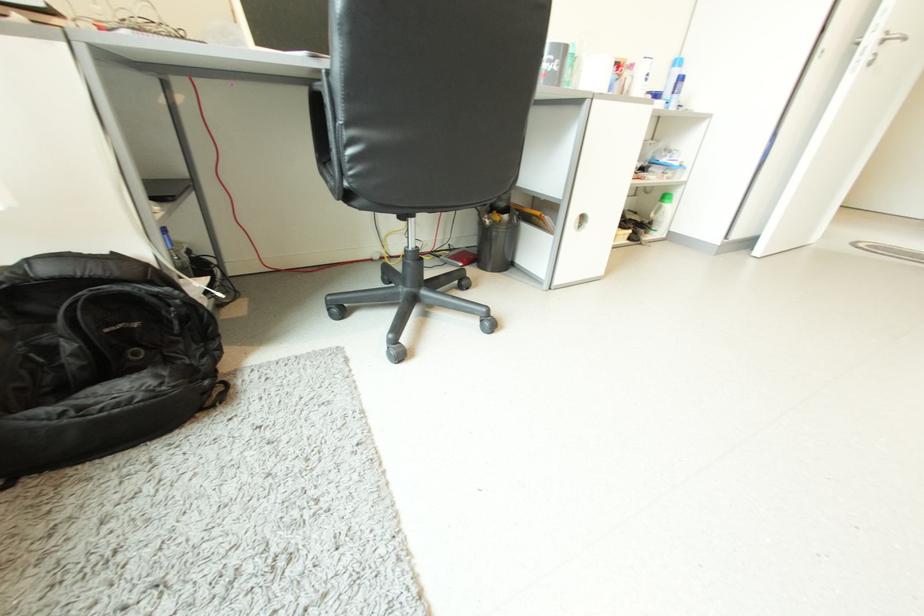
Find where to lift the grey mesh trashcan. Please return your answer as a coordinate pair (x, y).

(495, 238)